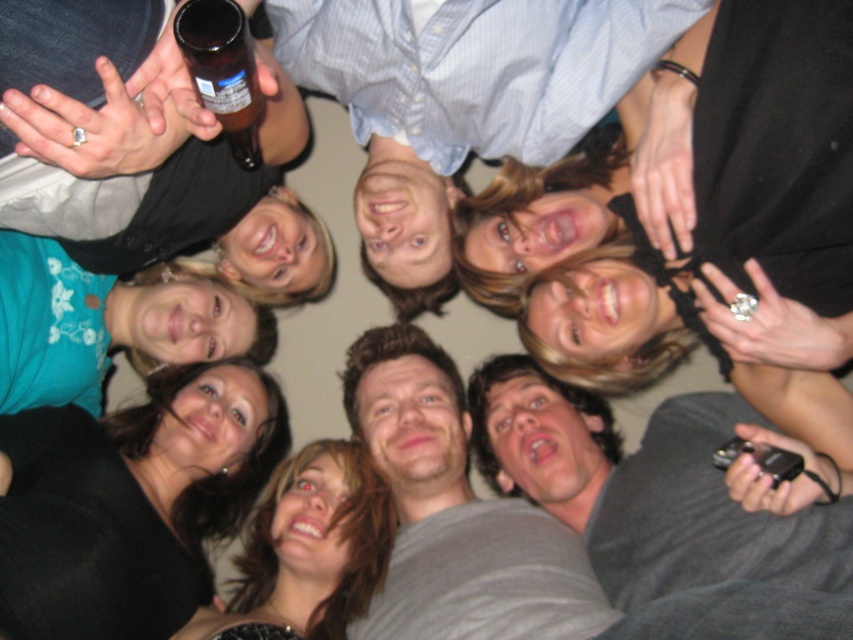
Which is below, gray cotton shirt at center or brown glass bottle at upper left?

gray cotton shirt at center is lower down.

Does gray cotton shirt at center appear on the left side of brown glass bottle at upper left?

In fact, gray cotton shirt at center is to the right of brown glass bottle at upper left.

I want to click on gray cotton shirt at center, so click(x=456, y=513).

I want to click on gray cotton shirt at center, so click(x=456, y=513).

Based on the photo, who is lower down, matte black bottle at upper left or teal fabric shirt at lower left?

teal fabric shirt at lower left is lower down.

Image resolution: width=853 pixels, height=640 pixels. What do you see at coordinates (144, 156) in the screenshot? I see `matte black bottle at upper left` at bounding box center [144, 156].

Is point (128, 136) farther from viewer compared to point (78, 275)?

No, it is in front of (78, 275).

Image resolution: width=853 pixels, height=640 pixels. Identify the location of matte black bottle at upper left. (144, 156).

Does gray fabric shirt at lower right have a lesser width compared to brown glass bottle at upper left?

No.

Can you confirm if gray fabric shirt at lower right is wider than brown glass bottle at upper left?

Yes, gray fabric shirt at lower right is wider than brown glass bottle at upper left.

Between point (524, 390) and point (231, 147), which one is positioned behind?

The point (524, 390) is more distant.

Where is `gray fabric shirt at lower right`? gray fabric shirt at lower right is located at coordinates (664, 513).